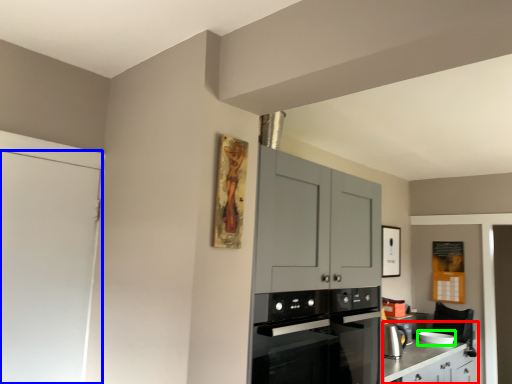
Question: Considering the real-world distances, which object is farthest from counter (highlighted by a red box)? door (highlighted by a blue box) or appliance (highlighted by a green box)?

Choices:
 (A) door
 (B) appliance

Answer: (A)